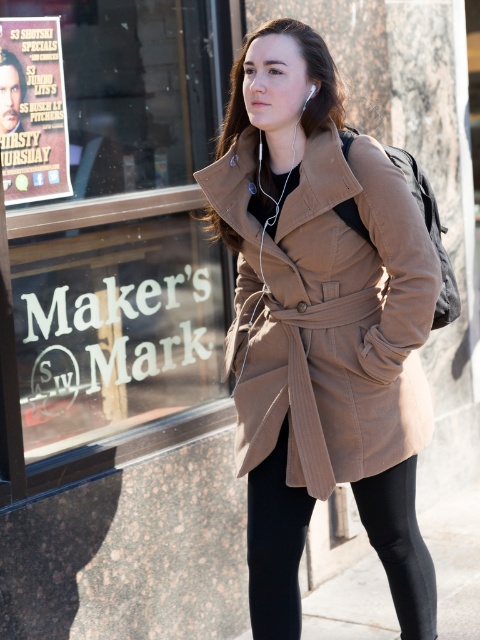
You are a customer entering the store and see the black smooth leggings at lower center and the matte paper poster at upper left. Which item is closer to the floor?

The black smooth leggings at lower center is positioned under the matte paper poster at upper left, so it is closer to the floor than the poster.

You are a customer looking at the storefront window. You see the corduroy brown coat at center and the matte paper poster at upper left. Which object is positioned to the right of the other?

The corduroy brown coat at center is to the right of the matte paper poster at upper left.